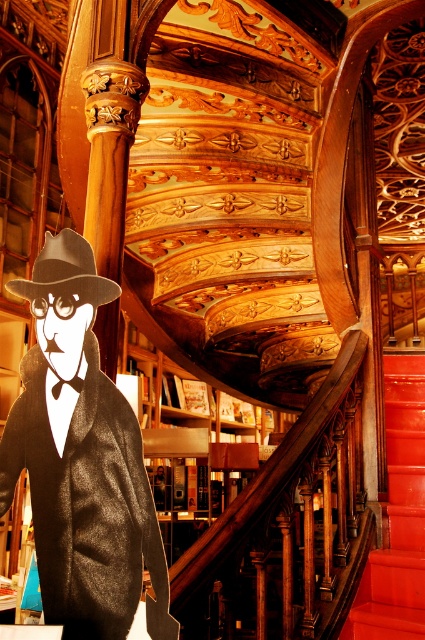
Is shiny red stair at center to the right of matte brown fedora at center from the viewer's perspective?

Correct, you'll find shiny red stair at center to the right of matte brown fedora at center.

How much distance is there between shiny red stair at center and matte brown fedora at center?

shiny red stair at center and matte brown fedora at center are 2.25 meters apart from each other.

Who is more distant from viewer, (396, 403) or (67, 237)?

Positioned behind is point (396, 403).

Where is `shiny red stair at center`? The height and width of the screenshot is (640, 425). shiny red stair at center is located at coordinates (396, 516).

Can you confirm if matte black coat at center is smaller than matte brown fedora at center?

No.

Can you confirm if matte black coat at center is positioned above matte brown fedora at center?

No.

Between point (87, 600) and point (105, 294), which one is positioned in front?

Point (87, 600)

Locate an element on the screen. The image size is (425, 640). matte black coat at center is located at coordinates (82, 460).

Is matte black coat at center closer to camera compared to shiny red stair at center?

Yes.

Between matte black coat at center and shiny red stair at center, which one appears on the left side from the viewer's perspective?

Positioned to the left is matte black coat at center.

Between point (93, 337) and point (374, 586), which one is positioned behind?

The point (374, 586) is behind.

Find the location of a particular element. The image size is (425, 640). matte black coat at center is located at coordinates (82, 460).